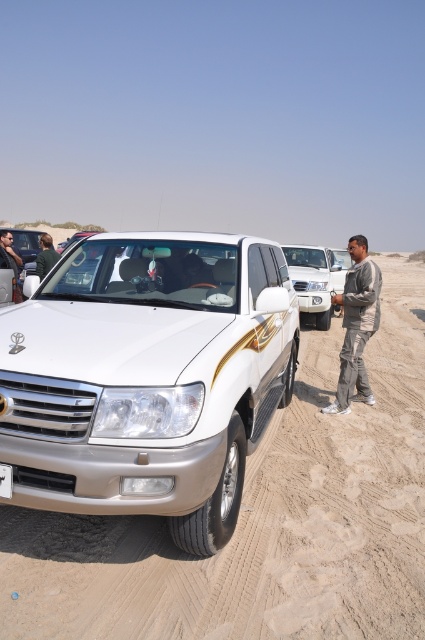
Can you confirm if white sand dirt track at center is positioned above white metallic suv at center?

No, white sand dirt track at center is not above white metallic suv at center.

Is white sand dirt track at center thinner than white metallic suv at center?

No.

The width and height of the screenshot is (425, 640). Describe the element at coordinates (261, 522) in the screenshot. I see `white sand dirt track at center` at that location.

The image size is (425, 640). I want to click on white sand dirt track at center, so click(x=261, y=522).

Can you confirm if white sand dirt track at center is thinner than white plastic license plate at center?

Incorrect, white sand dirt track at center's width is not less than white plastic license plate at center's.

Describe the element at coordinates (261, 522) in the screenshot. I see `white sand dirt track at center` at that location.

Between point (221, 580) and point (3, 477), which one is positioned in front?

Point (3, 477)

Find the location of a particular element. white sand dirt track at center is located at coordinates (261, 522).

Is white sand dirt track at center thinner than gray cotton pants at right?

Incorrect, white sand dirt track at center's width is not less than gray cotton pants at right's.

Describe the element at coordinates (261, 522) in the screenshot. I see `white sand dirt track at center` at that location.

Where is `white sand dirt track at center`? The height and width of the screenshot is (640, 425). white sand dirt track at center is located at coordinates (261, 522).